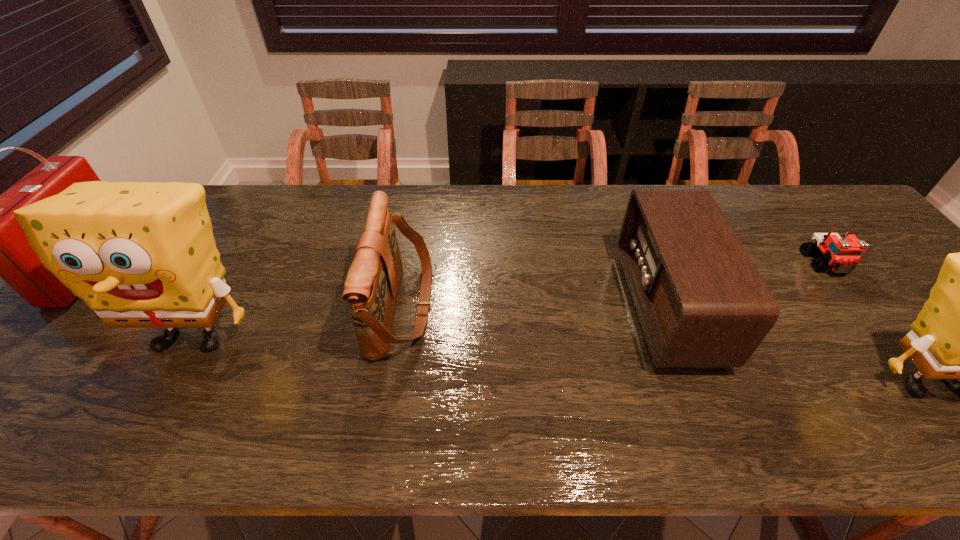
Where is `vacant space at the far edge of the desktop`? The image size is (960, 540). vacant space at the far edge of the desktop is located at coordinates (534, 187).

In the image, there is a desktop. At what (x,y) coordinates should I click in order to perform the action: click on vacant space at the near edge. Please return your answer as a coordinate pair (x, y). Looking at the image, I should click on (198, 388).

You are a GUI agent. You are given a task and a screenshot of the screen. Output one action in this format:
    pyautogui.click(x=<x>, y=<y>)
    Task: Click on the unoccupied area between the Lego and the fourth object from right to left
    The width and height of the screenshot is (960, 540).
    Given the screenshot: What is the action you would take?
    pyautogui.click(x=613, y=285)

Locate an element on the screen. The image size is (960, 540). free space between the radio receiver and the third object from left to right is located at coordinates (534, 306).

Image resolution: width=960 pixels, height=540 pixels. Identify the location of free space between the Lego and the leftmost object. [458, 265].

This screenshot has height=540, width=960. What are the coordinates of `free spot between the left sponge and the third object from right to left` in the screenshot? It's located at (431, 320).

Locate an element on the screen. vacant space that's between the third object from right to left and the taller sponge is located at coordinates (431, 320).

Identify which object is the fourth closest to the radio receiver. Please provide its 2D coordinates. Your answer should be formatted as a tuple, i.e. [(x, y)], where the tuple contains the x and y coordinates of a point satisfying the conditions above.

[(140, 255)]

This screenshot has width=960, height=540. In order to click on object that is the second closest to the radio receiver in this screenshot , I will do 841,255.

This screenshot has height=540, width=960. In order to click on vacant space that satisfies the following two spatial constraints: 1. on the front-facing side of the Lego; 2. on the front-facing side of the fourth object from right to left in this screenshot , I will do `click(858, 306)`.